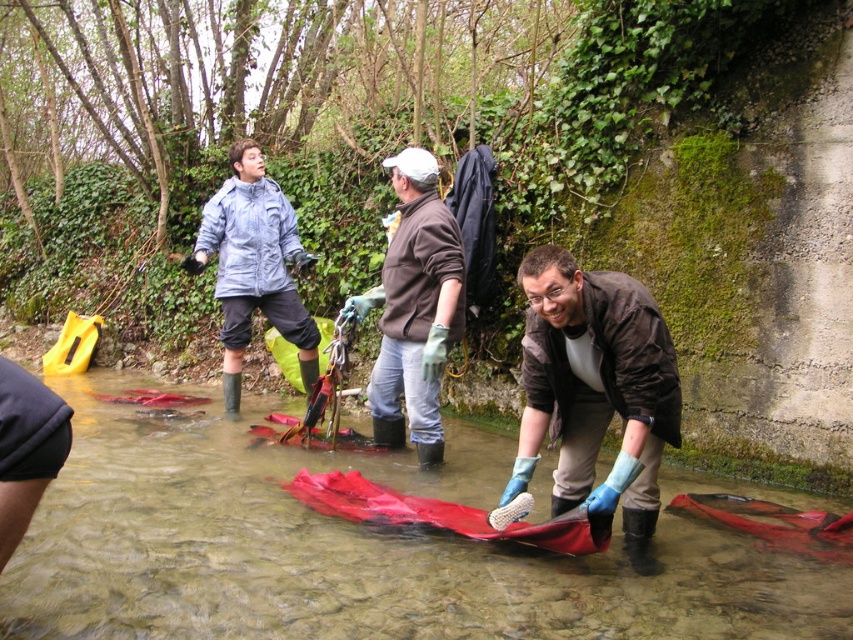
Question: Which of the following is the closest to the observer?

Choices:
 (A) (218, 410)
 (B) (434, 429)

Answer: (B)

Question: Is red fabric at center in front of brown fuzzy sweater at center?

Choices:
 (A) yes
 (B) no

Answer: (A)

Question: Which point is farther to the camera?

Choices:
 (A) (286, 317)
 (B) (392, 371)
 (C) (621, 476)

Answer: (A)

Question: Is blue rubber gloves at center positioned before brown fuzzy sweater at center?

Choices:
 (A) no
 (B) yes

Answer: (B)

Question: Is brown fuzzy sweater at center positioned before light blue waterproof jacket at left?

Choices:
 (A) yes
 (B) no

Answer: (A)

Question: Considering the real-world distances, which object is closest to the light blue waterproof jacket at left?

Choices:
 (A) brown fuzzy sweater at center
 (B) red fabric at center
 (C) blue rubber gloves at center

Answer: (A)